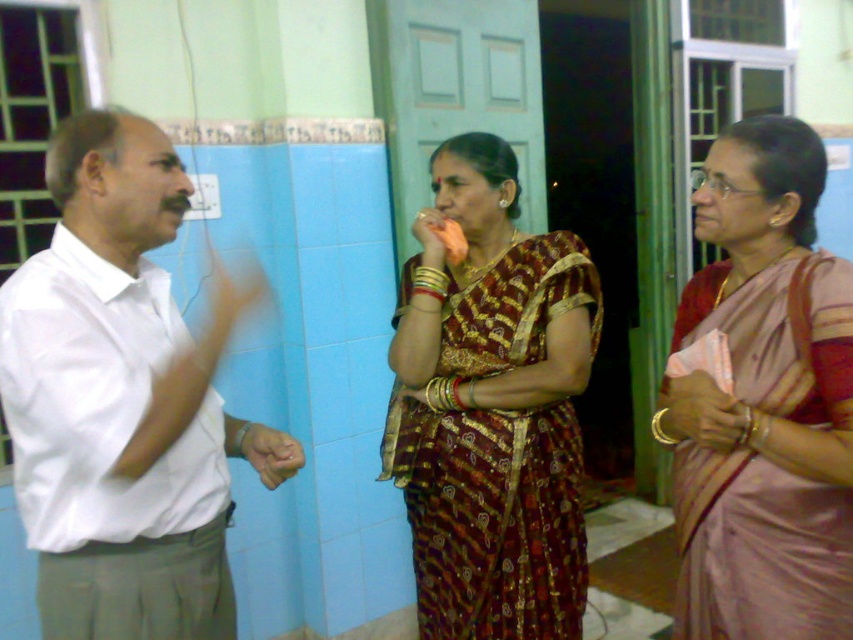
Question: Does white cotton shirt at left appear on the right side of pink silk saree at center?

Choices:
 (A) no
 (B) yes

Answer: (A)

Question: Is white cotton shirt at left to the right of pink silk saree at center from the viewer's perspective?

Choices:
 (A) yes
 (B) no

Answer: (B)

Question: Among these points, which one is farthest from the camera?

Choices:
 (A) (811, 355)
 (B) (434, 248)
 (C) (28, 372)

Answer: (B)

Question: Among these points, which one is farthest from the camera?

Choices:
 (A) (456, 328)
 (B) (785, 352)

Answer: (A)

Question: From the image, what is the correct spatial relationship of pink silk saree at center in relation to maroon silk saree at center?

Choices:
 (A) below
 (B) above

Answer: (B)

Question: Which object is farther from the camera taking this photo?

Choices:
 (A) maroon silk saree at center
 (B) pink silk saree at center
 (C) white cotton shirt at left

Answer: (A)